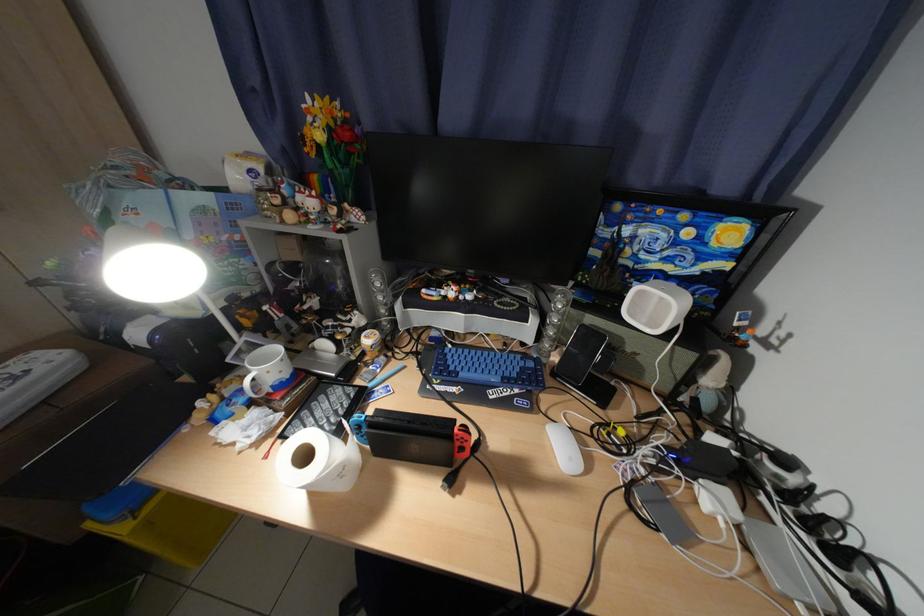
This screenshot has width=924, height=616. What do you see at coordinates (565, 448) in the screenshot?
I see `the white computer mouse` at bounding box center [565, 448].